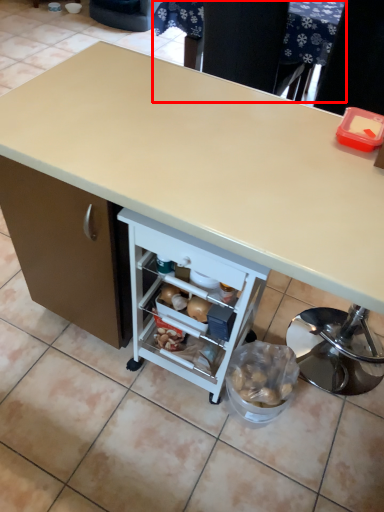
Question: From the image's perspective, what is the correct spatial relationship of table (annotated by the red box) in relation to desk?

Choices:
 (A) above
 (B) below

Answer: (A)